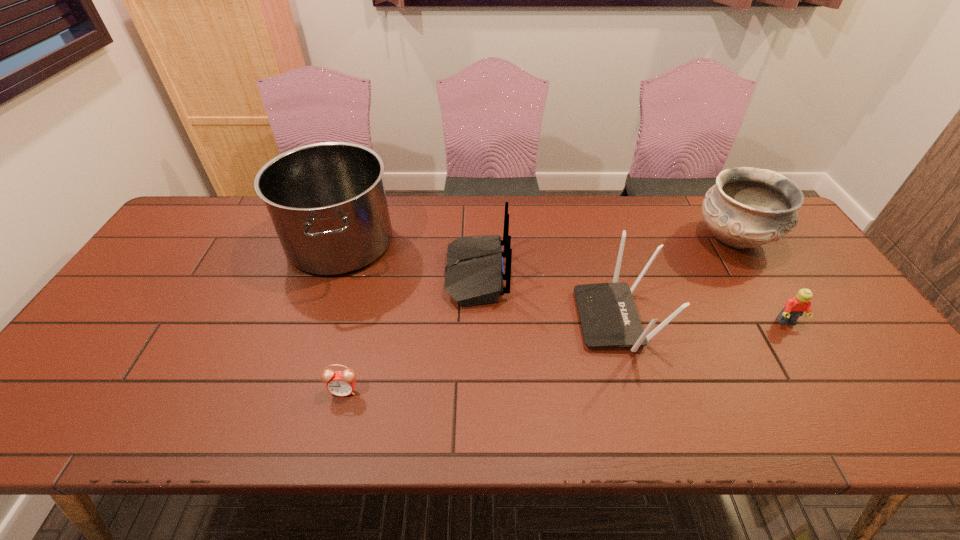
This screenshot has width=960, height=540. In the image, there is a desktop. In order to click on vacant space at the far edge in this screenshot , I will do `click(587, 237)`.

Locate an element on the screen. The image size is (960, 540). blank area at the left edge is located at coordinates (184, 275).

I want to click on vacant region at the right edge of the desktop, so click(x=814, y=341).

The height and width of the screenshot is (540, 960). In the image, there is a desktop. Identify the location of free space at the far left corner. (196, 226).

Find the location of a particular element. The height and width of the screenshot is (540, 960). vacant area at the near left corner of the desktop is located at coordinates (94, 414).

This screenshot has width=960, height=540. What are the coordinates of `free point at the near right corner` in the screenshot? It's located at (942, 437).

Locate an element on the screen. The height and width of the screenshot is (540, 960). free space that is in between the pottery and the nearest object is located at coordinates (539, 315).

The width and height of the screenshot is (960, 540). Identify the location of free space between the nearest object and the right router. (481, 355).

Identify the location of vacant region between the fifth tallest object and the shortest object. The height and width of the screenshot is (540, 960). (565, 356).

The image size is (960, 540). What are the coordinates of `empty space that is in between the tallest object and the pottery` in the screenshot? It's located at (537, 241).